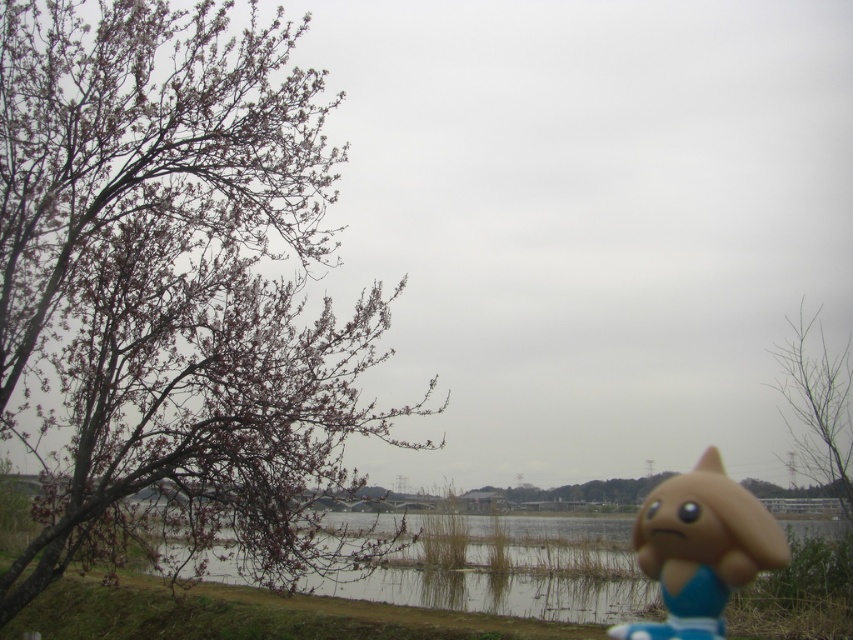
Consider the image. You are a photographer setting up a tripod in this scene. You want to capture both the bare branches at left and the matte plastic toy at lower right in your shot. Given their heights, which object will appear larger in the photo?

The bare branches at left will appear larger in the photo because they have a greater height compared to the matte plastic toy at lower right.

You are an artist planning to paint this scene. You need to decide which object, the clear water at lake right or the bare branches at upper right, should be placed higher in your painting to accurately represent their positions in the image. Which one should you choose?

The clear water at lake right is much taller than the bare branches at upper right, so you should place the clear water at lake right higher in your painting to accurately represent their positions.

You are a photographer trying to capture the matte plastic toy at lower right without the bare branches at left overlapping it. Can you adjust your position to avoid the branches?

The bare branches at left might be wider than the matte plastic toy at lower right, so adjusting your position could help avoid overlap if the branches are indeed wider.